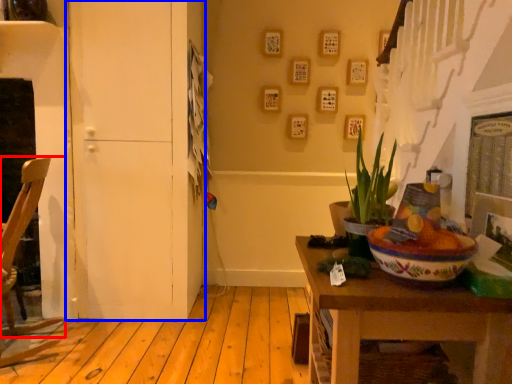
Question: Which point is further to the camera, chair (highlighted by a red box) or door (highlighted by a blue box)?

Choices:
 (A) chair
 (B) door

Answer: (B)